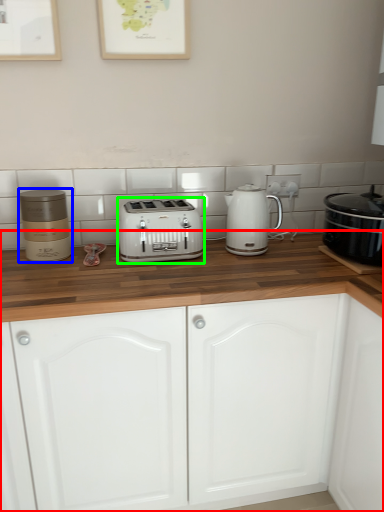
Question: Considering the real-world distances, which object is closest to cabinetry (highlighted by a red box)? appliance (highlighted by a blue box) or toaster (highlighted by a green box).

Choices:
 (A) appliance
 (B) toaster

Answer: (B)